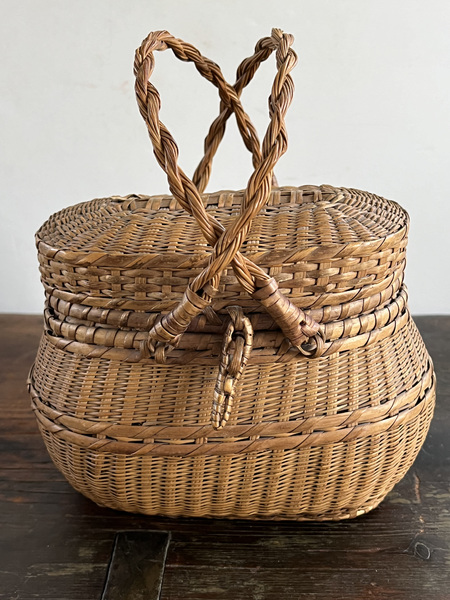
Locate an element on the screen. This screenshot has height=600, width=450. knob in wooden table is located at coordinates [421, 551].